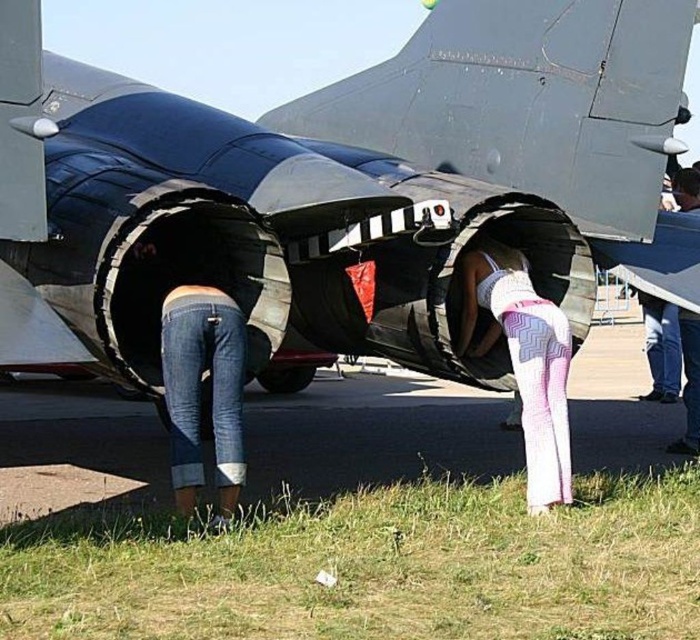
Can you confirm if black asphalt at lower center is positioned above jeans at lower left?

No, black asphalt at lower center is not above jeans at lower left.

Is black asphalt at lower center below jeans at lower left?

Correct, black asphalt at lower center is located below jeans at lower left.

I want to click on black asphalt at lower center, so click(372, 433).

Which is behind, point (522, 300) or point (231, 384)?

The point (522, 300) is behind.

Who is more forward, (476, 266) or (214, 364)?

Point (214, 364) is more forward.

This screenshot has width=700, height=640. I want to click on pink/white textured leggings at lower center, so click(525, 362).

Is black asphalt at lower center shorter than pink/white textured leggings at lower center?

Yes, black asphalt at lower center is shorter than pink/white textured leggings at lower center.

Who is more forward, (638, 413) or (545, 470)?

Positioned in front is point (545, 470).

Who is more forward, (354, 406) or (477, 275)?

Point (477, 275) is in front.

This screenshot has height=640, width=700. I want to click on black asphalt at lower center, so click(372, 433).